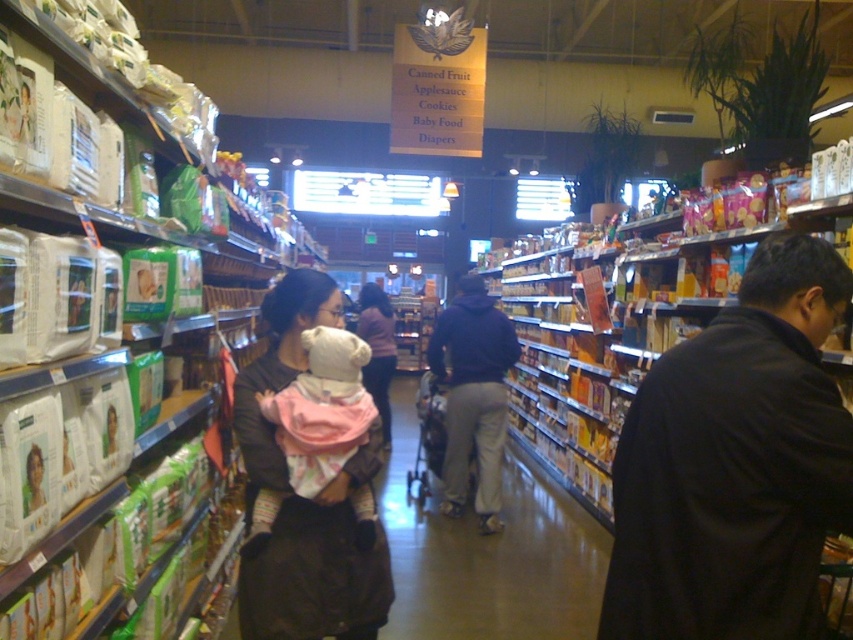
Is point (325, 406) more distant than point (456, 349)?

That is False.

Between pink fabric baby at center and dark blue hoodie at center, which one has less height?

Standing shorter between the two is pink fabric baby at center.

Between point (347, 417) and point (460, 291), which one is positioned in front?

Positioned in front is point (347, 417).

Locate an element on the screen. The width and height of the screenshot is (853, 640). pink fabric baby at center is located at coordinates (321, 410).

Is pink fabric baby at center to the right of matte pink sweater at center from the viewer's perspective?

Indeed, pink fabric baby at center is positioned on the right side of matte pink sweater at center.

Is point (296, 461) farther from viewer compared to point (384, 308)?

No, (296, 461) is in front of (384, 308).

Does point (351, 403) come behind point (386, 408)?

No, it is not.

Image resolution: width=853 pixels, height=640 pixels. What are the coordinates of `pink fabric baby at center` in the screenshot? It's located at coord(321,410).

At what (x,y) coordinates should I click in order to perform the action: click on black matte jacket at right. Please return your answer as a coordinate pair (x, y). Looking at the image, I should click on (735, 464).

Is black matte jacket at right above pink fabric baby at center?

Correct, black matte jacket at right is located above pink fabric baby at center.

The height and width of the screenshot is (640, 853). What are the coordinates of `black matte jacket at right` in the screenshot? It's located at (735, 464).